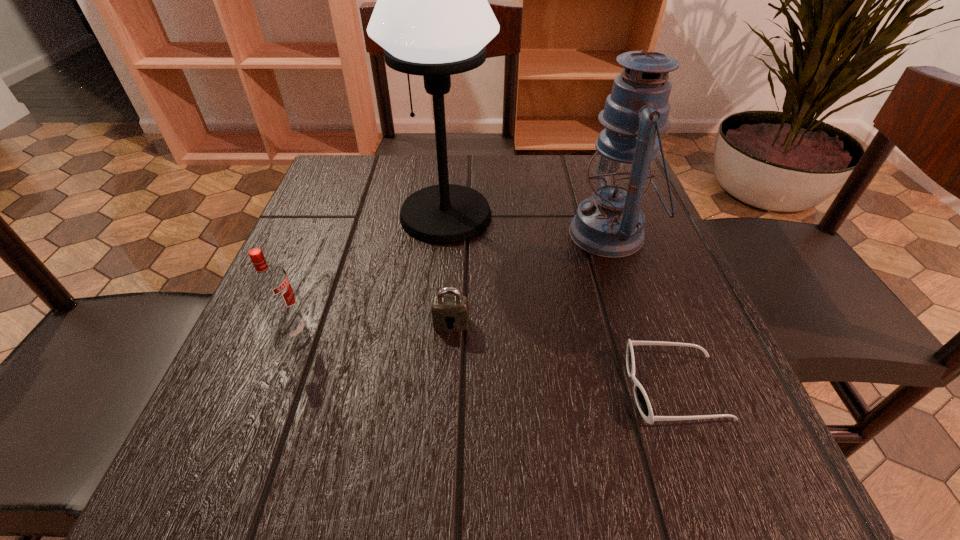
This screenshot has height=540, width=960. I want to click on table lamp, so click(x=432, y=17).

The image size is (960, 540). I want to click on the fourth shortest object, so click(x=609, y=224).

This screenshot has height=540, width=960. What are the coordinates of `the third shortest object` in the screenshot? It's located at (269, 284).

This screenshot has height=540, width=960. In order to click on vodka in this screenshot , I will do `click(269, 284)`.

What are the coordinates of `padlock` in the screenshot? It's located at (450, 313).

You are a GUI agent. You are given a task and a screenshot of the screen. Output one action in this format:
    pyautogui.click(x=<x>, y=<y>)
    Task: Click on the sunglasses
    
    Given the screenshot: What is the action you would take?
    pyautogui.click(x=641, y=398)

I want to click on the shortest object, so [x=641, y=398].

Find the location of a particular element. The height and width of the screenshot is (540, 960). vacant space located on the left of the tallest object is located at coordinates (327, 215).

The height and width of the screenshot is (540, 960). Find the location of `vacant space located 0.150m on the front-facing side of the lantern`. vacant space located 0.150m on the front-facing side of the lantern is located at coordinates (496, 234).

The height and width of the screenshot is (540, 960). Identify the location of blank area located on the front-facing side of the lantern. (374, 234).